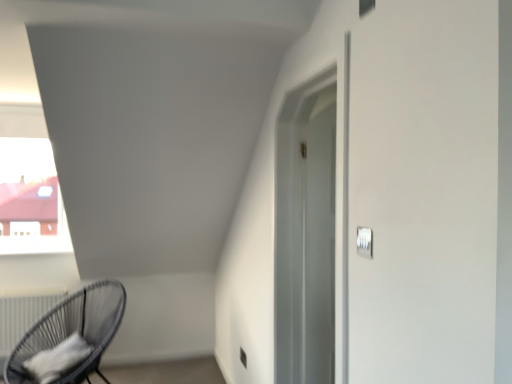
The width and height of the screenshot is (512, 384). Find the location of `free space above white matte radiator at lower left (from a real-world perspective)`. free space above white matte radiator at lower left (from a real-world perspective) is located at coordinates (33, 283).